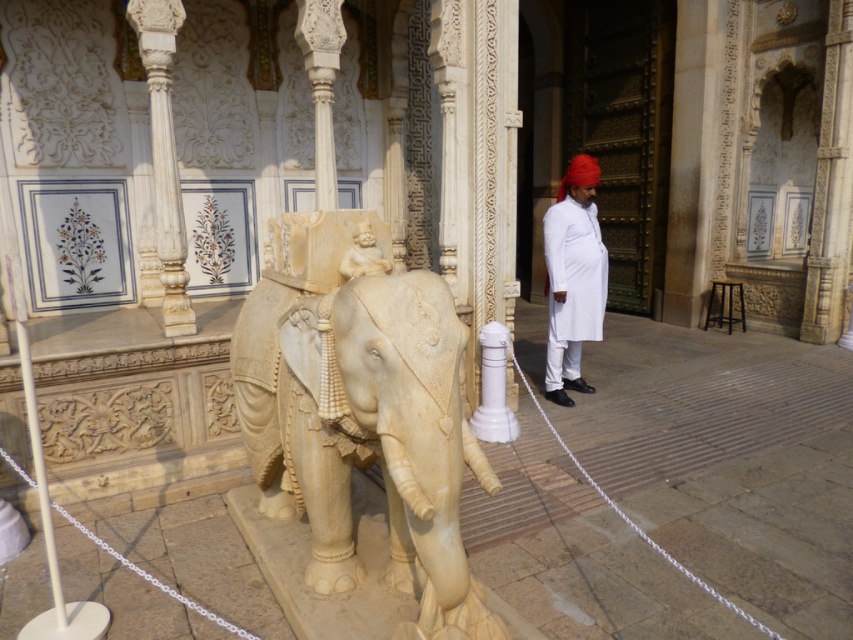
Question: Which point is farther to the camera?

Choices:
 (A) (445, 284)
 (B) (569, 349)

Answer: (B)

Question: Considering the relative positions of white marble elephant at center and white cotton turban at right in the image provided, where is white marble elephant at center located with respect to white cotton turban at right?

Choices:
 (A) below
 (B) above

Answer: (A)

Question: Is the position of white marble elephant at center more distant than that of white cotton turban at right?

Choices:
 (A) no
 (B) yes

Answer: (A)

Question: Which point is closer to the camera?

Choices:
 (A) white cotton turban at right
 (B) white marble elephant at center

Answer: (B)

Question: Which point is closer to the camera taking this photo?

Choices:
 (A) (439, 442)
 (B) (566, 397)

Answer: (A)

Question: Can you confirm if white marble elephant at center is positioned to the right of white cotton turban at right?

Choices:
 (A) no
 (B) yes

Answer: (A)